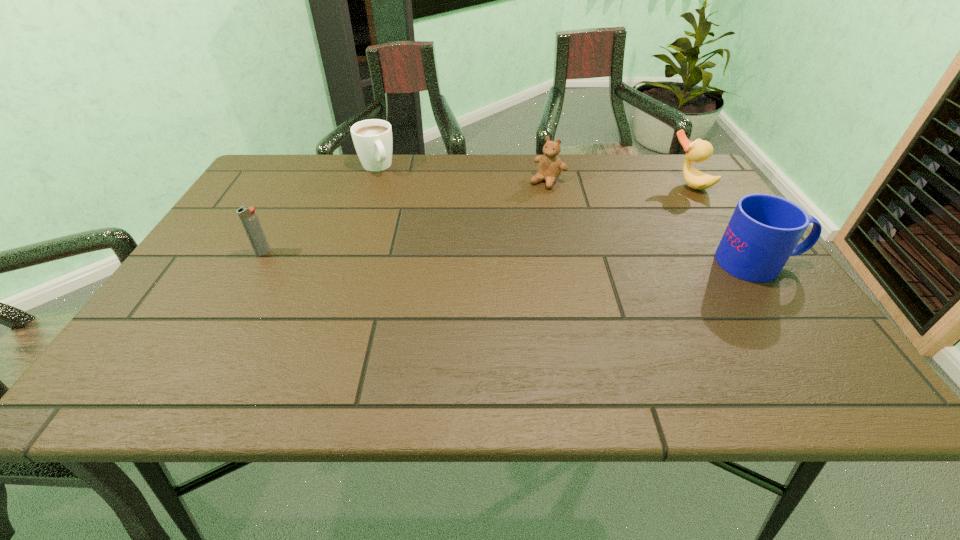
Select which object is the second closest to the duck. Please provide its 2D coordinates. Your answer should be formatted as a tuple, i.e. [(x, y)], where the tuple contains the x and y coordinates of a point satisfying the conditions above.

[(550, 166)]

Where is `blank area in the image that satisfies the following two spatial constraints: 1. on the front side of the duck; 2. on the side with the handle of the mug`? blank area in the image that satisfies the following two spatial constraints: 1. on the front side of the duck; 2. on the side with the handle of the mug is located at coordinates (738, 262).

This screenshot has height=540, width=960. I want to click on free space that satisfies the following two spatial constraints: 1. on the front side of the duck; 2. on the side with the handle of the mug, so click(738, 262).